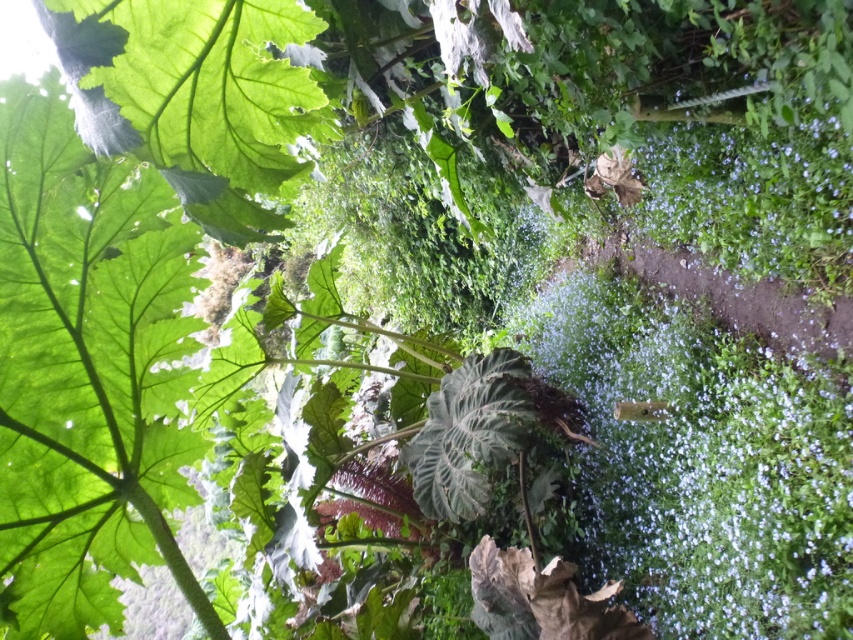
Between point (787, 173) and point (437, 440), which one is positioned behind?

Point (437, 440)

Does purple matte flower at center-right appear on the left side of dark green textured leaf at center?

In fact, purple matte flower at center-right is to the right of dark green textured leaf at center.

Between point (842, 220) and point (476, 355), which one is positioned behind?

Positioned behind is point (476, 355).

The width and height of the screenshot is (853, 640). I want to click on purple matte flower at center-right, so click(x=751, y=196).

Does green matte leaf at center appear over purple matte flower at center-right?

Incorrect, green matte leaf at center is not positioned above purple matte flower at center-right.

From the picture: Can you confirm if green matte leaf at center is positioned to the right of purple matte flower at center-right?

No, green matte leaf at center is not to the right of purple matte flower at center-right.

Image resolution: width=853 pixels, height=640 pixels. Find the location of `green matte leaf at center`. green matte leaf at center is located at coordinates (86, 372).

Is white matte flowers at center wider than dark green textured leaf at center?

Yes, white matte flowers at center is wider than dark green textured leaf at center.

Between white matte flowers at center and dark green textured leaf at center, which one appears on the right side from the viewer's perspective?

Positioned to the right is white matte flowers at center.

Is point (833, 390) positioned after point (471, 400)?

No, it is not.

Where is `white matte flowers at center`? white matte flowers at center is located at coordinates (701, 464).